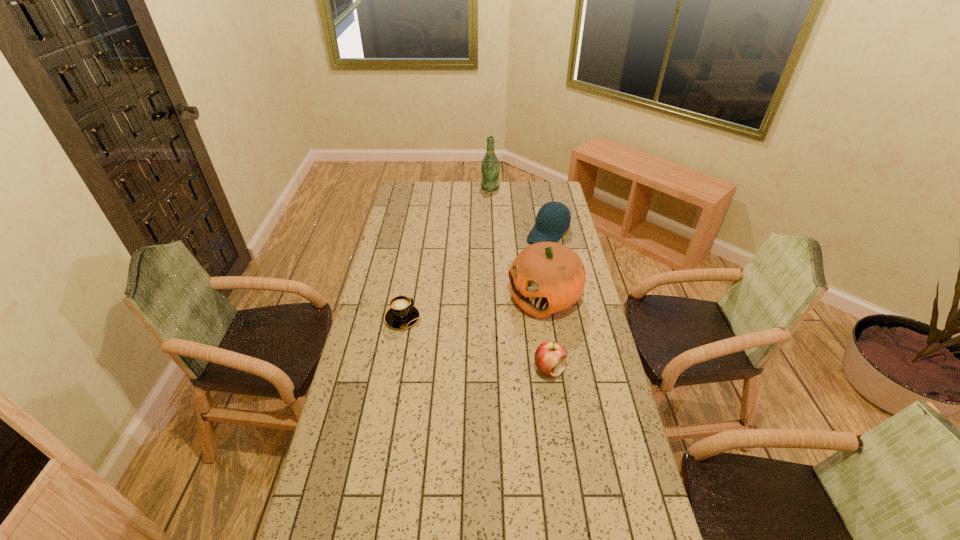
I want to click on vacant area that lies between the tallest object and the baseball cap, so click(519, 211).

You are a GUI agent. You are given a task and a screenshot of the screen. Output one action in this format:
    pyautogui.click(x=<x>, y=<y>)
    Task: Click on the free space between the fourth shortest object and the leftmost object
    Image resolution: width=960 pixels, height=540 pixels.
    Given the screenshot: What is the action you would take?
    pyautogui.click(x=474, y=308)

This screenshot has width=960, height=540. What are the coordinates of `vacant area that lies between the leftmost object and the second shortest object` in the screenshot? It's located at (476, 343).

In order to click on free space that is in between the fourth shortest object and the cappuccino in this screenshot , I will do `click(474, 308)`.

I want to click on free space between the cappuccino and the farthest object, so click(446, 253).

Find the location of a particular element. Image resolution: width=960 pixels, height=540 pixels. vacant point located between the shortest object and the tallest object is located at coordinates (x=446, y=253).

Point out which object is positioned as the nearest to the second tallest object. Please provide its 2D coordinates. Your answer should be formatted as a tuple, i.e. [(x, y)], where the tuple contains the x and y coordinates of a point satisfying the conditions above.

[(550, 357)]

The image size is (960, 540). Find the location of `the closest object relative to the pumpkin`. the closest object relative to the pumpkin is located at coordinates (550, 357).

Where is `vacant position in the image that satisfies the following two spatial constraints: 1. on the front side of the pumpkin; 2. on the right side of the tallest object`? Image resolution: width=960 pixels, height=540 pixels. vacant position in the image that satisfies the following two spatial constraints: 1. on the front side of the pumpkin; 2. on the right side of the tallest object is located at coordinates (494, 298).